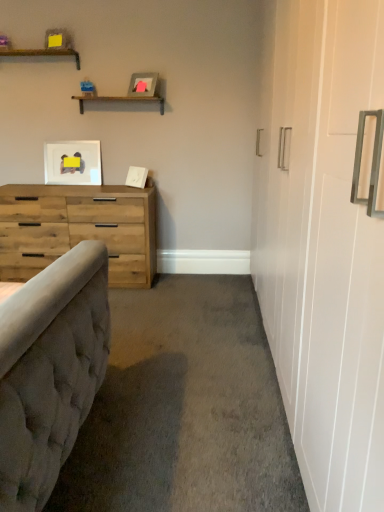
Question: Should I look upward or downward to see wooden shelf at upper center, arranged as the 2th shelf when viewed from the top?

Choices:
 (A) up
 (B) down

Answer: (A)

Question: Does matte white picture frame at upper left, acting as the second picture frame starting from the right, lie behind wooden shelf at upper left, which is the first shelf in top-to-bottom order?

Choices:
 (A) yes
 (B) no

Answer: (A)

Question: Is matte white picture frame at upper left, arranged as the 2th picture frame when viewed from the top, to the right of wooden shelf at upper left, the 1th shelf viewed from the left, from the viewer's perspective?

Choices:
 (A) no
 (B) yes

Answer: (B)

Question: Does matte white picture frame at upper left, acting as the second picture frame starting from the right, have a smaller size compared to wooden shelf at upper left, which is the first shelf in top-to-bottom order?

Choices:
 (A) no
 (B) yes

Answer: (B)

Question: Does matte white picture frame at upper left, acting as the second picture frame starting from the front, have a greater width compared to wooden shelf at upper left, the 1th shelf viewed from the left?

Choices:
 (A) no
 (B) yes

Answer: (A)

Question: Does matte white picture frame at upper left, placed as the first picture frame when sorted from left to right, touch wooden shelf at upper left, acting as the second shelf starting from the bottom?

Choices:
 (A) yes
 (B) no

Answer: (B)

Question: Would you consider matte white picture frame at upper left, placed as the first picture frame when sorted from left to right, to be distant from wooden shelf at upper left, which is the first shelf in top-to-bottom order?

Choices:
 (A) no
 (B) yes

Answer: (A)

Question: Is matte gray picture frame at upper center, the second picture frame when ordered from left to right, thinner than wooden shelf at upper center, which is the first shelf from right to left?

Choices:
 (A) no
 (B) yes

Answer: (B)

Question: Can you confirm if matte gray picture frame at upper center, the 1th picture frame in the right-to-left sequence, is taller than wooden shelf at upper center, which is the first shelf from right to left?

Choices:
 (A) no
 (B) yes

Answer: (B)

Question: From a real-world perspective, is matte gray picture frame at upper center, the first picture frame from the top, under wooden shelf at upper center, arranged as the 2th shelf when viewed from the top?

Choices:
 (A) yes
 (B) no

Answer: (B)

Question: Considering the relative sizes of matte gray picture frame at upper center, the first picture frame from the top, and wooden shelf at upper center, which is the first shelf from right to left, in the image provided, is matte gray picture frame at upper center, the first picture frame from the top, smaller than wooden shelf at upper center, which is the first shelf from right to left,?

Choices:
 (A) no
 (B) yes

Answer: (B)

Question: Can you confirm if matte gray picture frame at upper center, the second picture frame when ordered from bottom to top, is shorter than wooden shelf at upper center, which is counted as the 1th shelf, starting from the bottom?

Choices:
 (A) no
 (B) yes

Answer: (A)

Question: Does matte gray picture frame at upper center, which is counted as the 1th picture frame, starting from the front, have a larger size compared to wooden shelf at upper center, which is the first shelf from right to left?

Choices:
 (A) yes
 (B) no

Answer: (B)

Question: Does wooden shelf at upper center, which is the 2th shelf in left-to-right order, come in front of natural wood dresser at left?

Choices:
 (A) yes
 (B) no

Answer: (B)